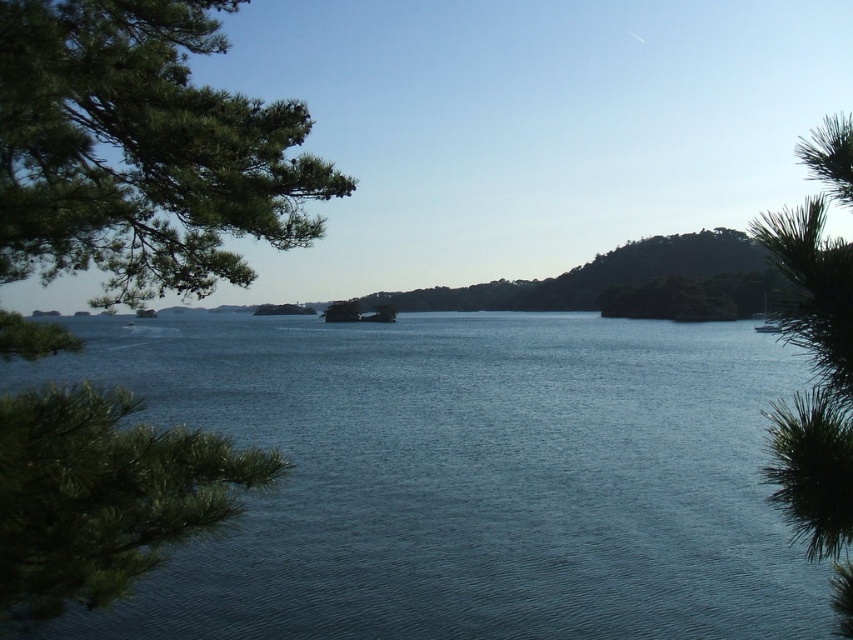
You are standing at the edge of the scene and want to walk to the blue water at center. However, there is a green matte tree at left in your path. Can you walk around the tree to reach the water?

The blue water at center is positioned under the green matte tree at left, so you can walk around the tree to reach the water since the water is located beneath it.

You are standing on the dock and want to cross to the other side of the lake. The white glossy boat at center is available. Considering the blue water at center is wider than the boat, can you use the boat to cross?

The blue water at center is wider than the white glossy boat at center, so the boat may not be able to cross the entire width of the water. You might need a larger vessel or alternative method.